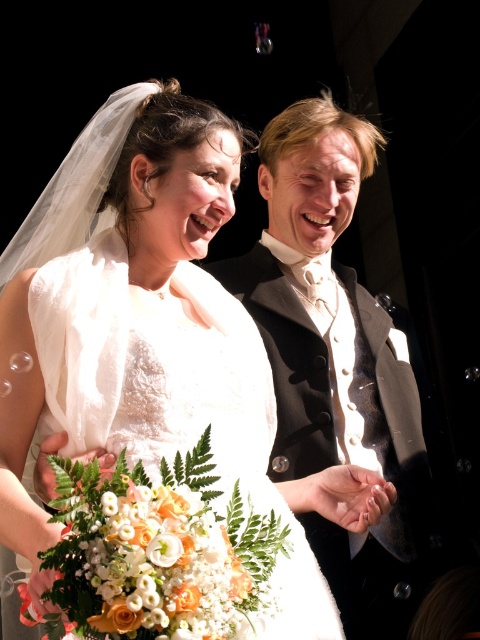
Question: Among these objects, which one is nearest to the camera?

Choices:
 (A) shiny black suit at center
 (B) white satin dress at center

Answer: (B)

Question: Does shiny black suit at center have a smaller size compared to white satin dress at center?

Choices:
 (A) yes
 (B) no

Answer: (B)

Question: Can you confirm if shiny black suit at center is bigger than white satin dress at center?

Choices:
 (A) yes
 (B) no

Answer: (A)

Question: Which of the following is the closest to the observer?

Choices:
 (A) shiny black suit at center
 (B) white satin dress at center

Answer: (B)

Question: Considering the relative positions of shiny black suit at center and white satin dress at center in the image provided, where is shiny black suit at center located with respect to white satin dress at center?

Choices:
 (A) left
 (B) right

Answer: (B)